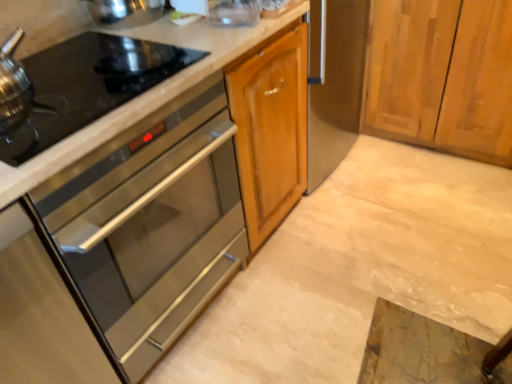
Identify the location of vacant area on top of stainless steel oven at left (from a real-world perspective). (109, 79).